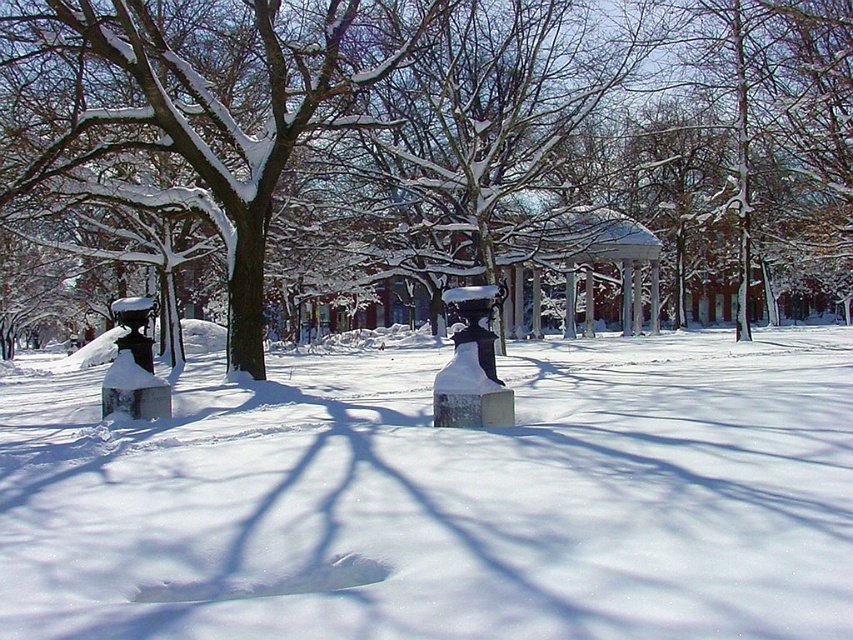
Question: Does white matte snow at center appear under snow-covered tree at center?

Choices:
 (A) yes
 (B) no

Answer: (A)

Question: Which point appears closest to the camera in this image?

Choices:
 (A) (795, 328)
 (B) (630, 218)

Answer: (B)

Question: Does white matte snow at center have a smaller size compared to snow-covered tree at center?

Choices:
 (A) no
 (B) yes

Answer: (B)

Question: Does white matte snow at center appear over snow-covered tree at center?

Choices:
 (A) no
 (B) yes

Answer: (A)